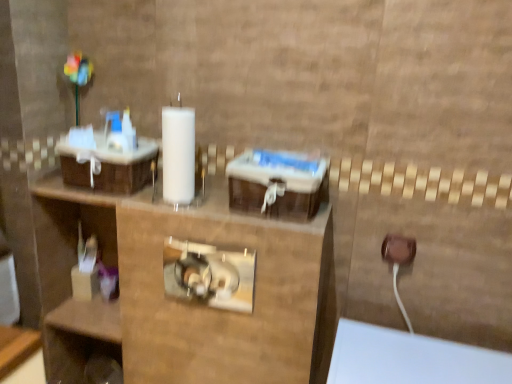
Image resolution: width=512 pixels, height=384 pixels. What do you see at coordinates (398, 249) in the screenshot?
I see `brown plastic outlet at lower right` at bounding box center [398, 249].

The height and width of the screenshot is (384, 512). What do you see at coordinates (71, 287) in the screenshot?
I see `translucent plastic container at lower left` at bounding box center [71, 287].

The height and width of the screenshot is (384, 512). What are the coordinates of `brown plastic outlet at lower right` in the screenshot? It's located at (398, 249).

Is brown plastic outlet at lower right positioned beyond the bounds of brown woven basket at left?

brown plastic outlet at lower right lies outside brown woven basket at left's area.

Which is closer, (389, 260) or (147, 160)?

Point (389, 260) is closer to the camera than point (147, 160).

Considering the positions of objects brown plastic outlet at lower right and brown woven basket at left in the image provided, who is more to the left, brown plastic outlet at lower right or brown woven basket at left?

Positioned to the left is brown woven basket at left.

From the image's perspective, is brown plastic outlet at lower right positioned above or below brown woven basket at left?

From the image's perspective, brown plastic outlet at lower right appears below brown woven basket at left.

Does point (119, 159) lie in front of point (70, 291)?

Yes.

Can you confirm if brown woven basket at left is bigger than translucent plastic container at lower left?

No, brown woven basket at left is not bigger than translucent plastic container at lower left.

Can you confirm if brown woven basket at left is positioned to the left of translucent plastic container at lower left?

Incorrect, brown woven basket at left is not on the left side of translucent plastic container at lower left.

From a real-world perspective, is brown woven basket at left positioned under translucent plastic container at lower left based on gravity?

No, from a real-world perspective, brown woven basket at left is not below translucent plastic container at lower left.

Is brown woven basket at left to the left of brown plastic outlet at lower right from the viewer's perspective?

Yes, brown woven basket at left is to the left of brown plastic outlet at lower right.

Where is `electric outlet located underneath the brown woven basket at left (from a real-world perspective)`? electric outlet located underneath the brown woven basket at left (from a real-world perspective) is located at coordinates pyautogui.click(x=398, y=249).

From a real-world perspective, relative to brown plastic outlet at lower right, is brown woven basket at left vertically above or below?

In terms of real-world spatial position, brown woven basket at left is above brown plastic outlet at lower right.

Is brown woven basket at left completely or partially outside of brown plastic outlet at lower right?

brown woven basket at left lies outside brown plastic outlet at lower right's area.

Is point (97, 212) positioned in front of point (83, 185)?

No, it is behind (83, 185).

Is translucent plastic container at lower left completely or partially outside of brown woven basket at left?

translucent plastic container at lower left is positioned outside brown woven basket at left.

Between translucent plastic container at lower left and brown woven basket at left, which one has more height?

With more height is translucent plastic container at lower left.

This screenshot has width=512, height=384. I want to click on electric outlet above the translucent plastic container at lower left (from a real-world perspective), so click(x=398, y=249).

From the image's perspective, which is below, brown plastic outlet at lower right or translucent plastic container at lower left?

From the image's view, translucent plastic container at lower left is below.

From a real-world perspective, is brown plastic outlet at lower right positioned above or below translucent plastic container at lower left?

From a real-world perspective, brown plastic outlet at lower right is physically above translucent plastic container at lower left.

Are brown plastic outlet at lower right and translucent plastic container at lower left beside each other?

There is a gap between brown plastic outlet at lower right and translucent plastic container at lower left.

Which of these two, translucent plastic container at lower left or brown plastic outlet at lower right, stands taller?

translucent plastic container at lower left is taller.

From the image's perspective, is translucent plastic container at lower left above brown plastic outlet at lower right?

Incorrect, from the image's perspective, translucent plastic container at lower left is lower than brown plastic outlet at lower right.

Identify the location of shelf located behind the brown plastic outlet at lower right. (x=71, y=287).

Where is `sink above the brown plastic outlet at lower right (from a real-world perspective)`? sink above the brown plastic outlet at lower right (from a real-world perspective) is located at coordinates tap(108, 157).

At what (x,y) coordinates should I click in order to perform the action: click on shelf on the left of the brown woven basket at left. Please return your answer as a coordinate pair (x, y). This screenshot has height=384, width=512. Looking at the image, I should click on (71, 287).

Estimate the real-world distances between objects in this image. Which object is further from translucent plastic container at lower left, brown plastic outlet at lower right or brown woven basket at left?

Based on the image, brown plastic outlet at lower right appears to be further to translucent plastic container at lower left.

Consider the image. When comparing their distances from brown plastic outlet at lower right, does translucent plastic container at lower left or brown woven basket at left seem closer?

Among the two, brown woven basket at left is located nearer to brown plastic outlet at lower right.

Looking at the image, which one is located further to brown plastic outlet at lower right, brown woven basket at left or translucent plastic container at lower left?

translucent plastic container at lower left is positioned further to the anchor brown plastic outlet at lower right.

Based on their spatial positions, is brown plastic outlet at lower right or translucent plastic container at lower left closer to brown woven basket at left?

translucent plastic container at lower left is closer to brown woven basket at left.

Estimate the real-world distances between objects in this image. Which object is closer to translucent plastic container at lower left, brown woven basket at left or brown plastic outlet at lower right?

Based on the image, brown woven basket at left appears to be nearer to translucent plastic container at lower left.

Which object lies nearer to the anchor point brown woven basket at left, translucent plastic container at lower left or brown plastic outlet at lower right?

translucent plastic container at lower left.

At what (x,y) coordinates should I click in order to perform the action: click on sink located between translucent plastic container at lower left and brown plastic outlet at lower right in the left-right direction. Please return your answer as a coordinate pair (x, y). This screenshot has height=384, width=512. Looking at the image, I should click on (108, 157).